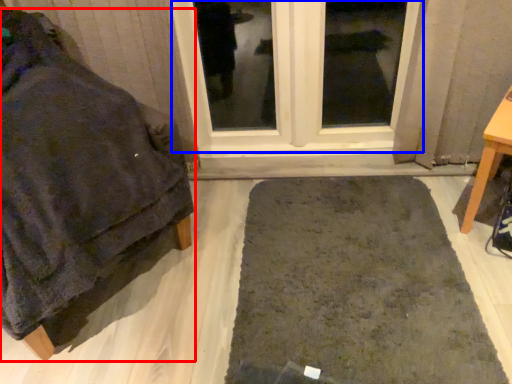
Question: Which point is further to the camera, furniture (highlighted by a red box) or window (highlighted by a blue box)?

Choices:
 (A) furniture
 (B) window

Answer: (B)